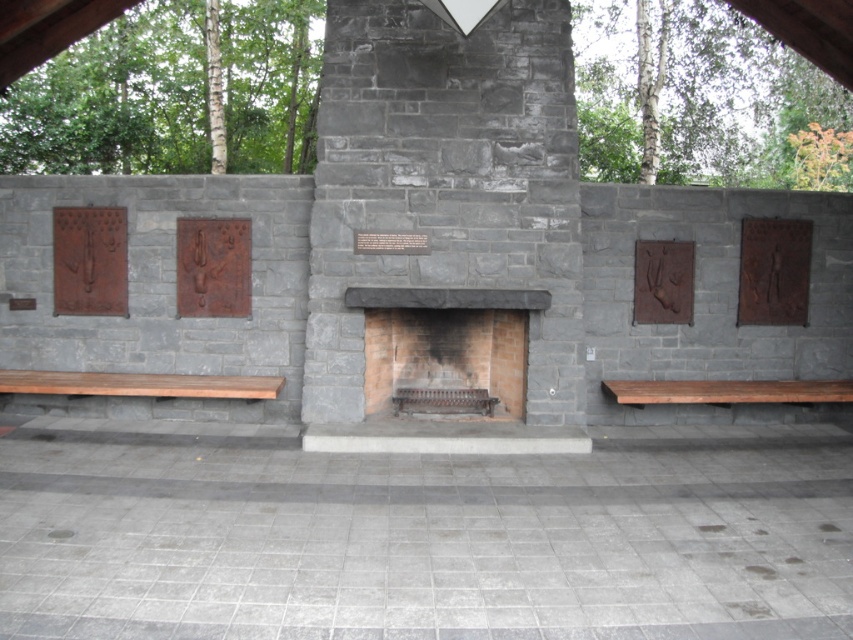
You are standing in front of the brick fireplace at center and want to sit on the brown wooden bench at left. Which direction should you move to reach the bench?

The brick fireplace at center is positioned on the right side of brown wooden bench at left, so you should move to your left to reach the bench.